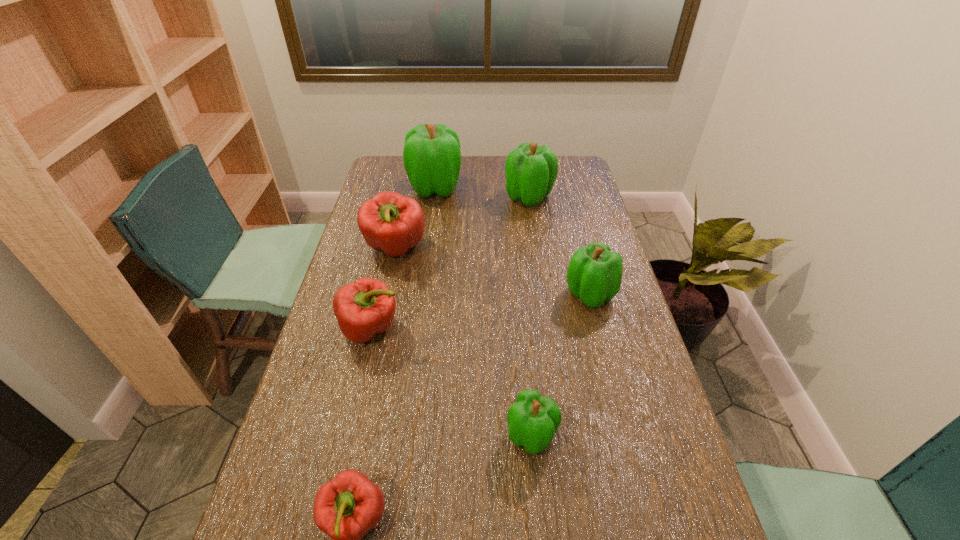
Locate an element on the screen. This screenshot has height=540, width=960. green bell pepper that is the second closest to the second nearest object is located at coordinates (531, 170).

Point out which green bell pepper is positioned as the second nearest to the second biggest green bell pepper. Please provide its 2D coordinates. Your answer should be formatted as a tuple, i.e. [(x, y)], where the tuple contains the x and y coordinates of a point satisfying the conditions above.

[(594, 274)]

Where is `pink bell pepper that is the second nearest to the third smallest green bell pepper`? pink bell pepper that is the second nearest to the third smallest green bell pepper is located at coordinates (366, 307).

This screenshot has width=960, height=540. I want to click on pink bell pepper that is the second closest to the sixth farthest bell pepper, so click(366, 307).

In order to click on free spot that satisfies the following two spatial constraints: 1. on the front side of the second biggest green bell pepper; 2. on the right side of the third biggest green bell pepper in this screenshot , I will do `click(543, 294)`.

Identify the location of free space that satisfies the following two spatial constraints: 1. on the back side of the tallest bell pepper; 2. on the left side of the farthest pink bell pepper. (409, 188).

Image resolution: width=960 pixels, height=540 pixels. Identify the location of vacant region that satisfies the following two spatial constraints: 1. on the front side of the farthest pink bell pepper; 2. on the left side of the second nearest bell pepper. [355, 435].